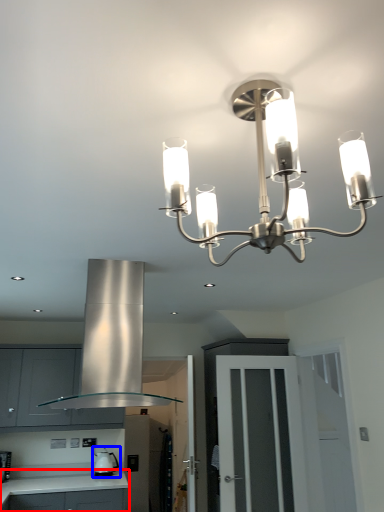
Question: Which point is further to the camera, countertop (highlighted by a red box) or appliance (highlighted by a blue box)?

Choices:
 (A) countertop
 (B) appliance

Answer: (B)